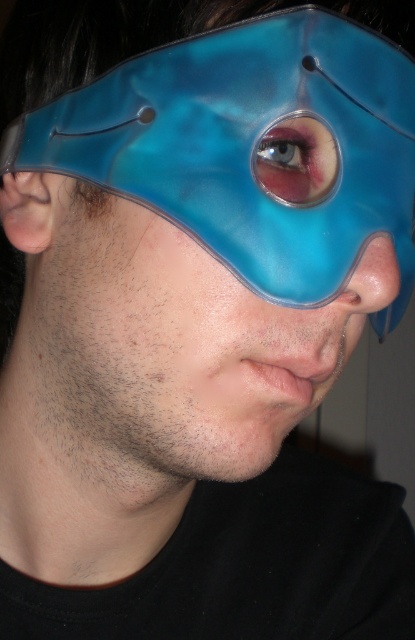
Between point (185, 221) and point (319, 140), which one is positioned behind?

The point (319, 140) is behind.

I want to click on transparent blue mask at upper right, so click(241, 144).

At what (x,y) coordinates should I click in order to perform the action: click on transparent blue mask at upper right. Please return your answer as a coordinate pair (x, y). Looking at the image, I should click on (241, 144).